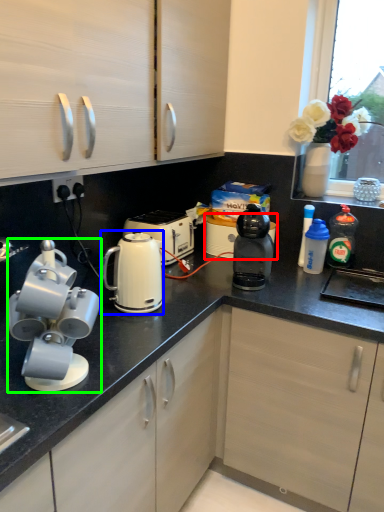
Question: Estimate the real-world distances between objects in this image. Which object is closer to appliance (highlighted by a red box), kitchen appliance (highlighted by a blue box) or home appliance (highlighted by a green box)?

Choices:
 (A) kitchen appliance
 (B) home appliance

Answer: (A)